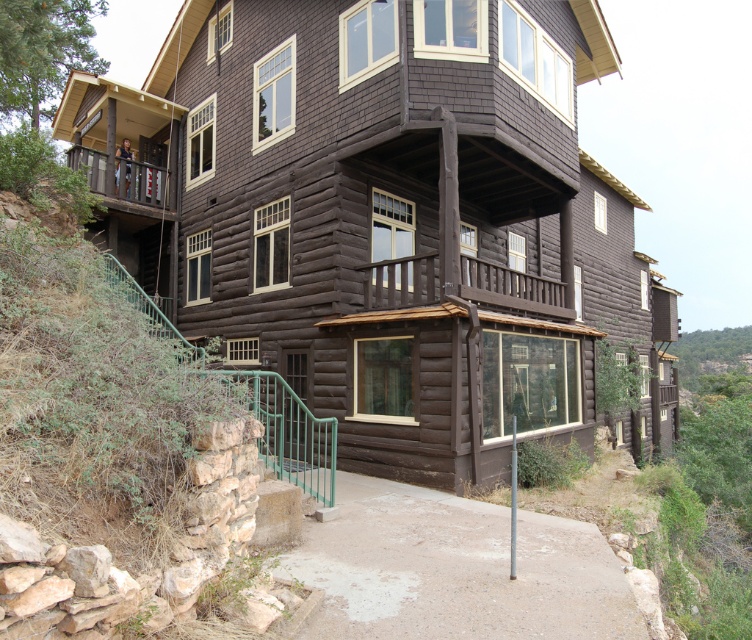
Question: Does dark wood cabin at center come in front of brown wooden porch at upper left?

Choices:
 (A) no
 (B) yes

Answer: (B)

Question: Which object appears farthest from the camera in this image?

Choices:
 (A) brown wooden porch at upper left
 (B) brown wooden porch at center
 (C) dark wood cabin at center

Answer: (A)

Question: Considering the real-world distances, which object is closest to the dark wood cabin at center?

Choices:
 (A) brown wooden porch at upper left
 (B) brown wooden porch at center

Answer: (B)

Question: Is dark wood cabin at center smaller than brown wooden porch at center?

Choices:
 (A) no
 (B) yes

Answer: (A)

Question: Is dark wood cabin at center positioned behind brown wooden porch at upper left?

Choices:
 (A) no
 (B) yes

Answer: (A)

Question: Among these objects, which one is farthest from the camera?

Choices:
 (A) brown wooden porch at upper left
 (B) dark wood cabin at center
 (C) brown wooden porch at center

Answer: (A)